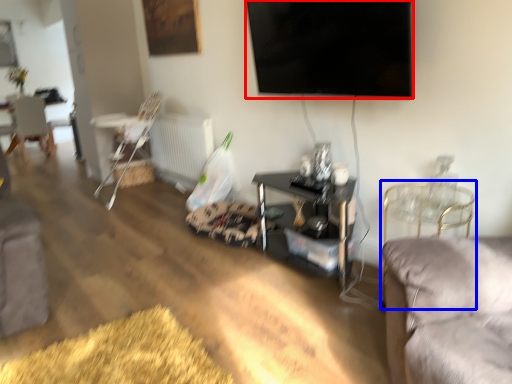
Question: Which of the following is the closest to the observer, television (highlighted by a red box) or chair (highlighted by a blue box)?

Choices:
 (A) television
 (B) chair

Answer: (A)